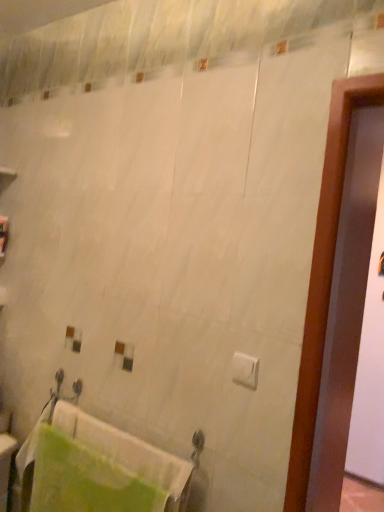
Question: Does white matte toilet paper at center appear on the right side of green fabric towel at lower left?

Choices:
 (A) no
 (B) yes

Answer: (B)

Question: Is white matte toilet paper at center taller than green fabric towel at lower left?

Choices:
 (A) yes
 (B) no

Answer: (B)

Question: Does white matte toilet paper at center have a larger size compared to green fabric towel at lower left?

Choices:
 (A) no
 (B) yes

Answer: (A)

Question: From the image's perspective, is white matte toilet paper at center below green fabric towel at lower left?

Choices:
 (A) no
 (B) yes

Answer: (A)

Question: Considering the relative sizes of white matte toilet paper at center and green fabric towel at lower left in the image provided, is white matte toilet paper at center wider than green fabric towel at lower left?

Choices:
 (A) yes
 (B) no

Answer: (B)

Question: Is white matte toilet paper at center facing towards green fabric towel at lower left?

Choices:
 (A) yes
 (B) no

Answer: (B)

Question: Can you confirm if green fabric towel at lower left is positioned to the right of white matte toilet paper at center?

Choices:
 (A) yes
 (B) no

Answer: (B)

Question: Does green fabric towel at lower left have a lesser width compared to white matte toilet paper at center?

Choices:
 (A) no
 (B) yes

Answer: (A)

Question: Does green fabric towel at lower left appear on the left side of white matte toilet paper at center?

Choices:
 (A) no
 (B) yes

Answer: (B)

Question: Can you confirm if green fabric towel at lower left is shorter than white matte toilet paper at center?

Choices:
 (A) yes
 (B) no

Answer: (B)

Question: Considering the relative sizes of green fabric towel at lower left and white matte toilet paper at center in the image provided, is green fabric towel at lower left bigger than white matte toilet paper at center?

Choices:
 (A) no
 (B) yes

Answer: (B)

Question: Is green fabric towel at lower left not within white matte toilet paper at center?

Choices:
 (A) no
 (B) yes

Answer: (B)

Question: Considering their positions, is green fabric towel at lower left located in front of or behind white matte toilet paper at center?

Choices:
 (A) front
 (B) behind

Answer: (B)